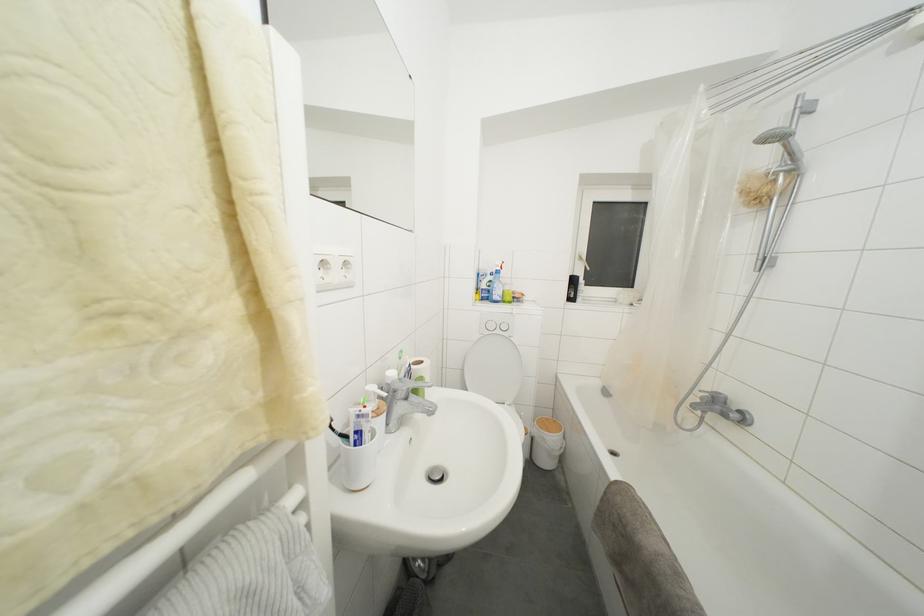
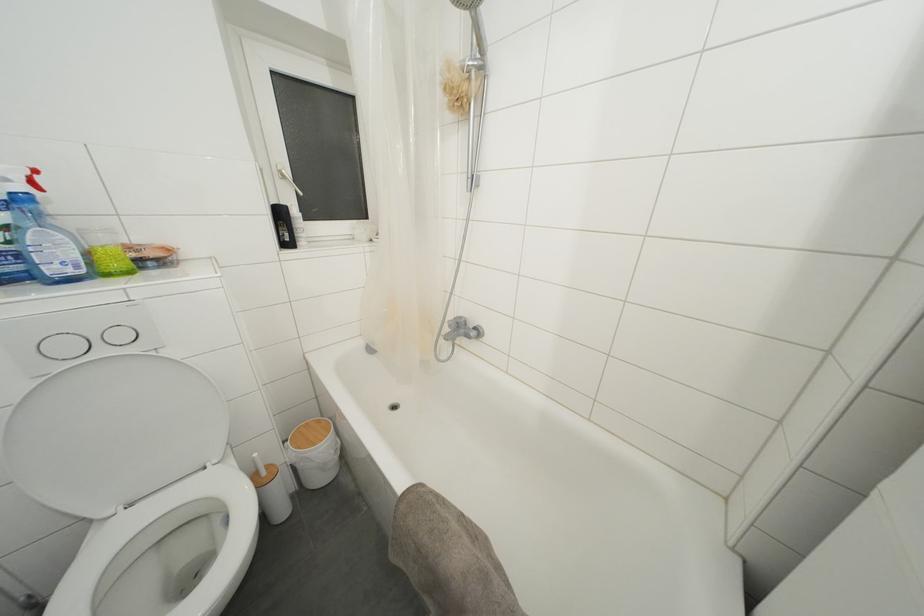
Where in the second image is the point corresponding to point 552,424 from the first image?

(310, 429)